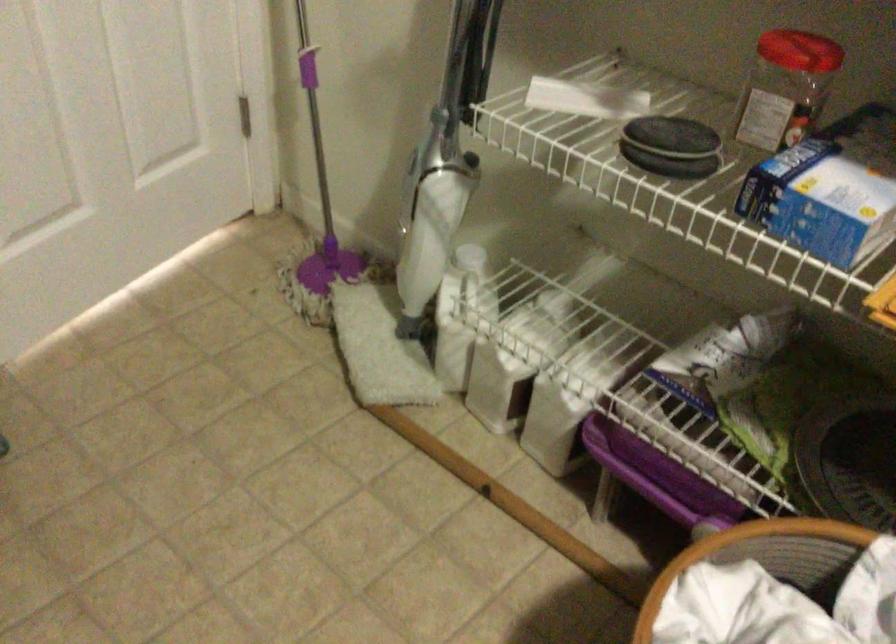
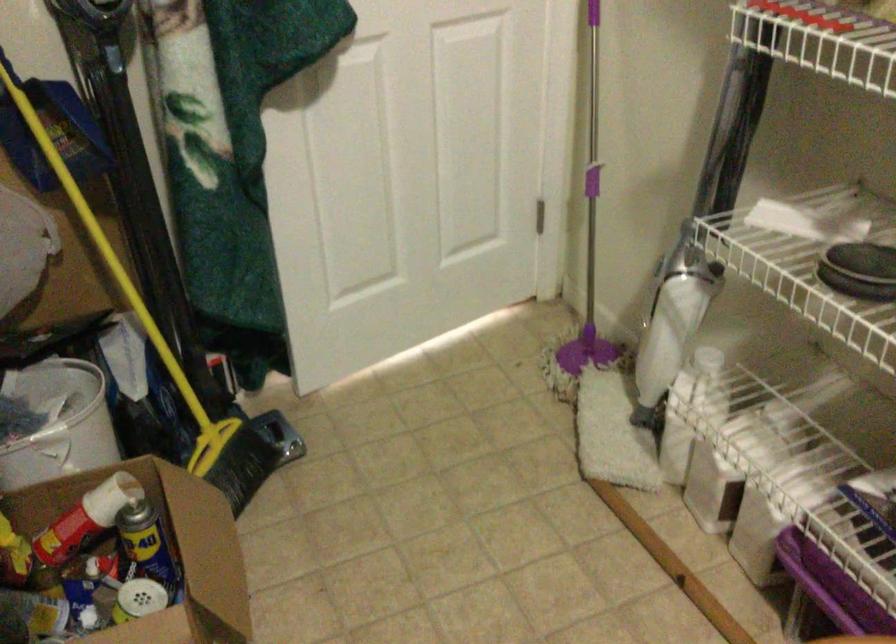
Find the pixel in the second image that matches (440,218) in the first image.

(674, 317)